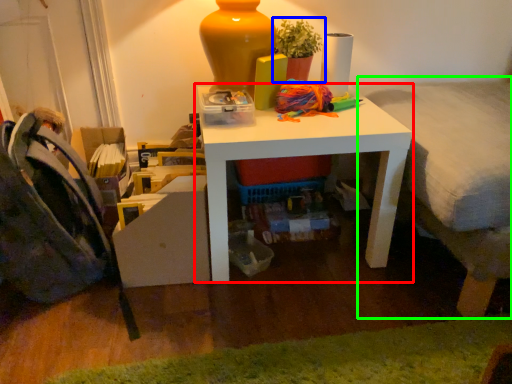
Question: Which is farther away from table (highlighted by a red box)? houseplant (highlighted by a blue box) or bed (highlighted by a green box)?

Choices:
 (A) houseplant
 (B) bed

Answer: (A)